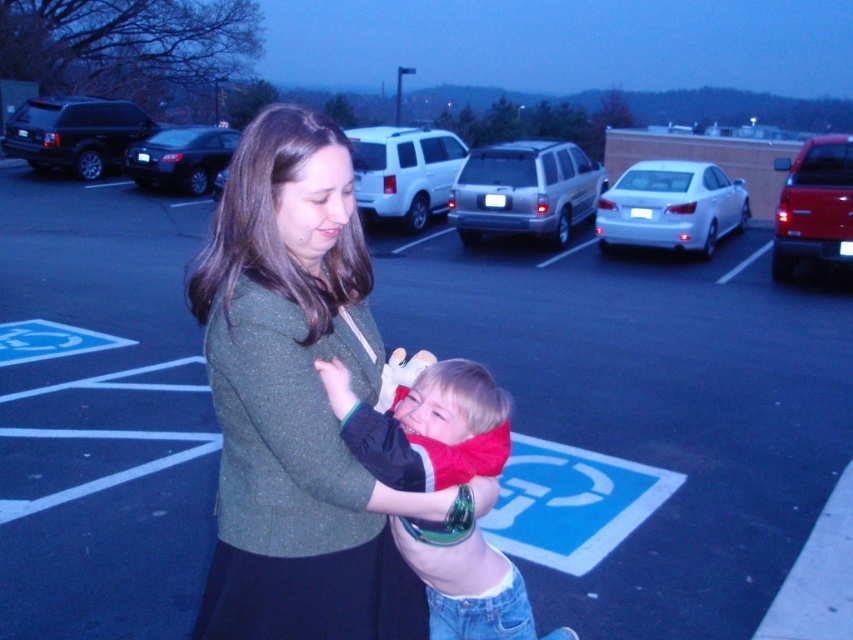
Is point (434, 600) in front of point (428, 148)?

Yes, point (434, 600) is closer to viewer.

Can you confirm if red fleece jacket at center is positioned to the left of white matte suv at center?

Incorrect, red fleece jacket at center is not on the left side of white matte suv at center.

Is point (350, 419) positioned after point (387, 148)?

No, it is in front of (387, 148).

Find the location of `red fleece jacket at center`. red fleece jacket at center is located at coordinates (425, 426).

Based on the photo, does shiny red truck at right have a lesser height compared to shiny black sedan at center?

Incorrect, shiny red truck at right's height does not fall short of shiny black sedan at center's.

Based on the photo, is shiny red truck at right smaller than shiny black sedan at center?

No.

Is point (775, 253) positioned after point (200, 125)?

No, (775, 253) is closer to viewer.

This screenshot has width=853, height=640. I want to click on shiny red truck at right, so [814, 205].

This screenshot has width=853, height=640. Find the location of `red fleece jacket at center`. red fleece jacket at center is located at coordinates (425, 426).

Is point (467, 520) behind point (850, 200)?

No.

You are a GUI agent. You are given a task and a screenshot of the screen. Output one action in this format:
    pyautogui.click(x=<x>, y=<y>)
    Task: Click on the red fleece jacket at center
    This screenshot has height=640, width=853.
    Given the screenshot: What is the action you would take?
    pyautogui.click(x=425, y=426)